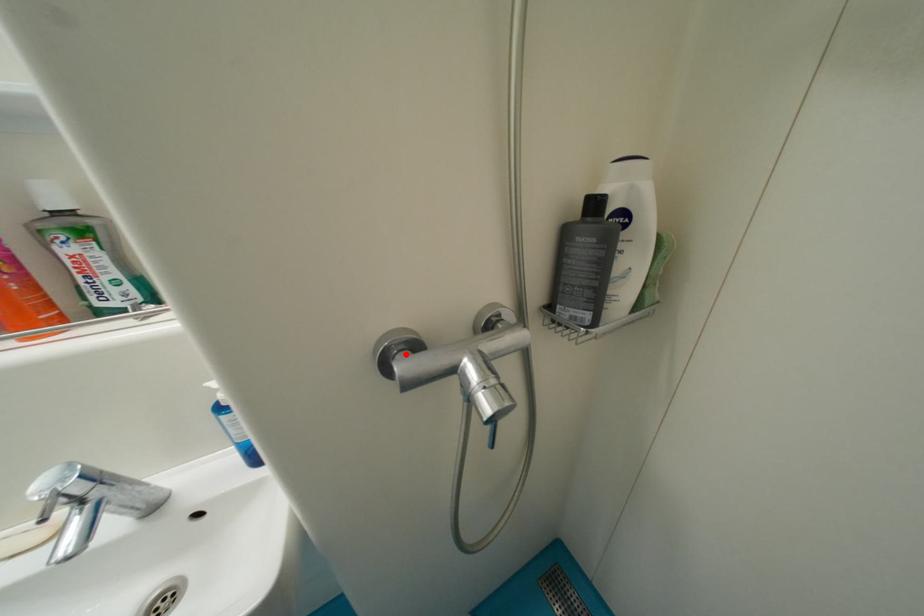
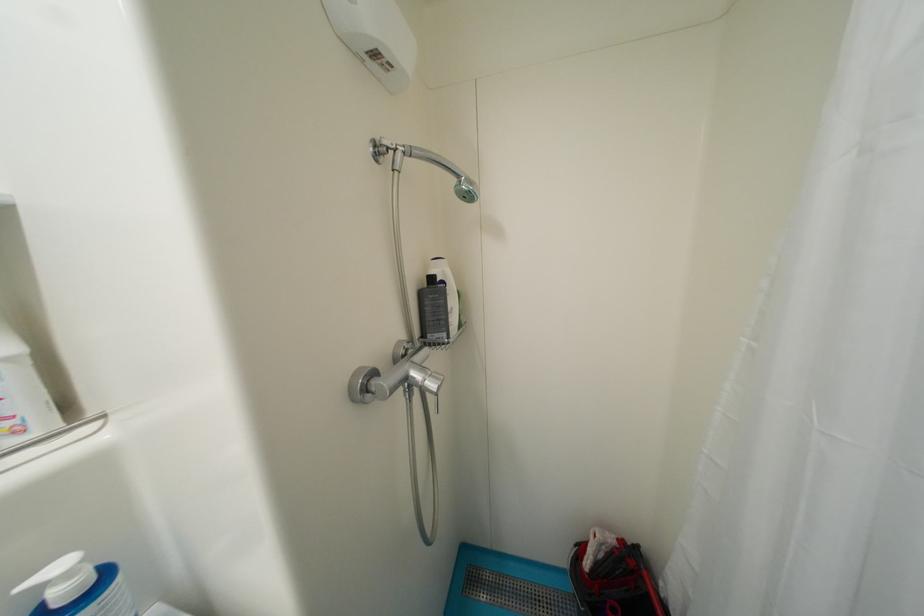
The point at the highlighted location is marked in the first image. Where is the corresponding point in the second image?

(374, 383)